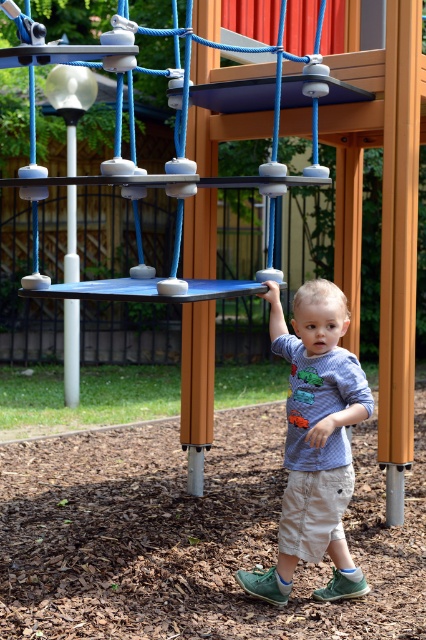
Who is more distant from viewer, [339,509] or [117,296]?

The point [339,509] is more distant.

Is point (313, 326) positioned behind point (253, 284)?

That is False.

You are a GUI agent. You are given a task and a screenshot of the screen. Output one action in this format:
    pyautogui.click(x=<x>, y=<y>)
    Task: Click on the blue cotton shirt at center
    This screenshot has height=640, width=426.
    Given the screenshot: What is the action you would take?
    pyautogui.click(x=314, y=442)